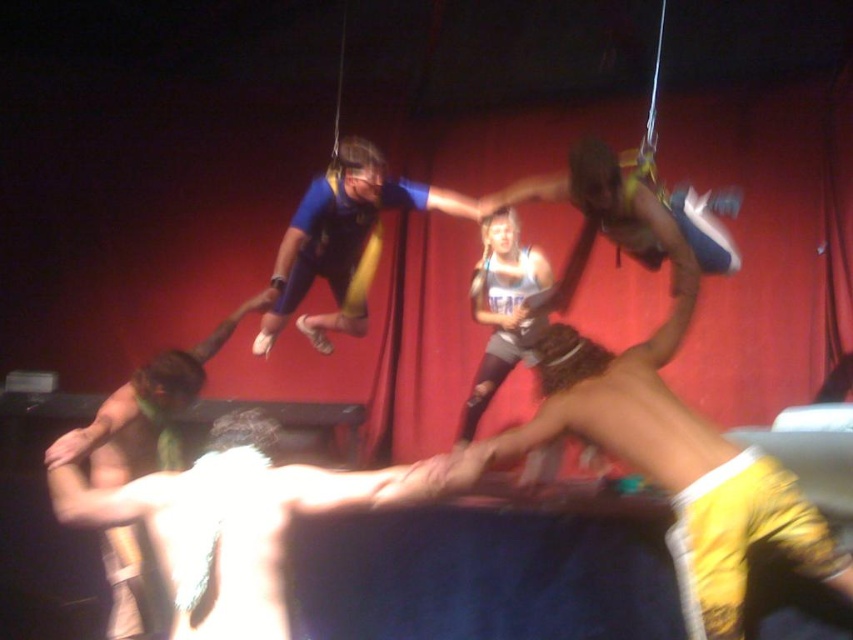
Does skinny white man at center appear on the right side of blue fabric at center?

Incorrect, skinny white man at center is not on the right side of blue fabric at center.

What do you see at coordinates (242, 518) in the screenshot?
I see `skinny white man at center` at bounding box center [242, 518].

I want to click on skinny white man at center, so click(242, 518).